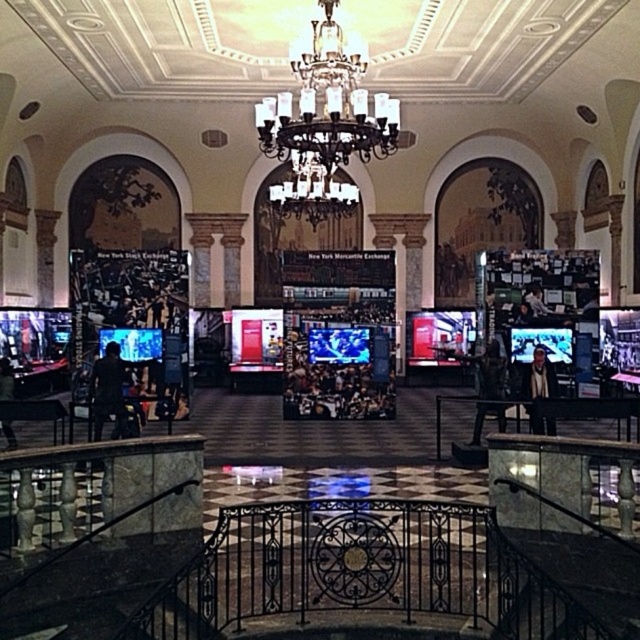
Is light brown leather jacket at center bigger than black leather jacket at lower left?

Correct, light brown leather jacket at center is larger in size than black leather jacket at lower left.

Can you confirm if light brown leather jacket at center is positioned to the left of black leather jacket at lower left?

Incorrect, light brown leather jacket at center is not on the left side of black leather jacket at lower left.

Is point (547, 365) positioned after point (8, 444)?

No, it is in front of (8, 444).

Locate an element on the screen. Image resolution: width=640 pixels, height=640 pixels. light brown leather jacket at center is located at coordinates (538, 376).

Which is behind, point (496, 344) or point (10, 438)?

The point (10, 438) is behind.

What do you see at coordinates (490, 372) in the screenshot?
I see `dark gray suit at center` at bounding box center [490, 372].

This screenshot has width=640, height=640. What are the coordinates of `dark gray suit at center` in the screenshot? It's located at click(490, 372).

Is crystal glass chandelier at center smaller than dark fabric jacket at lower left?

No.

Does point (312, 189) lie behind point (102, 413)?

Yes, it is.

Is point (364, 52) more distant than point (96, 417)?

No, (364, 52) is in front of (96, 417).

Where is `crystal glass chandelier at center`? crystal glass chandelier at center is located at coordinates (324, 125).